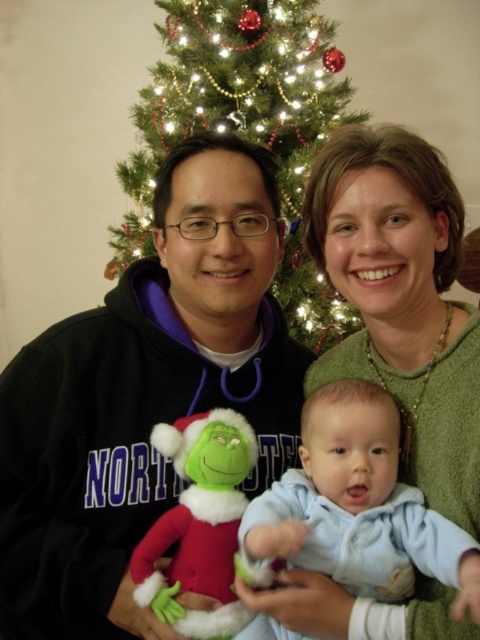
Does black fleece sweatshirt at left have a greater height compared to velvety plush toy at center?

Yes.

Does point (69, 612) come farther from viewer compared to point (207, 444)?

Yes.

Where is `black fleece sweatshirt at left`? Image resolution: width=480 pixels, height=640 pixels. black fleece sweatshirt at left is located at coordinates (144, 396).

Where is `black fleece sweatshirt at left`? black fleece sweatshirt at left is located at coordinates click(144, 396).

Does black fleece sweatshirt at left have a lesser width compared to green matte christmas tree at upper center?

Indeed, black fleece sweatshirt at left has a lesser width compared to green matte christmas tree at upper center.

Which is in front, point (57, 634) or point (121, 166)?

Point (57, 634) is in front.

You are a GUI agent. You are given a task and a screenshot of the screen. Output one action in this format:
    pyautogui.click(x=<x>, y=<y>)
    Task: Click on the black fleece sweatshirt at left
    The image size is (480, 640).
    Given the screenshot: What is the action you would take?
    pyautogui.click(x=144, y=396)

Identify the location of black fleece sweatshirt at left. The width and height of the screenshot is (480, 640). (144, 396).

Is the position of green matte christmas tree at upper center more distant than that of light blue fleece baby at center?

Yes, it is.

Who is positioned more to the right, green matte christmas tree at upper center or light blue fleece baby at center?

light blue fleece baby at center

Is point (223, 112) farther from viewer compared to point (474, 579)?

Yes, it is.

Where is `green matte christmas tree at upper center`? This screenshot has height=640, width=480. green matte christmas tree at upper center is located at coordinates point(244,125).